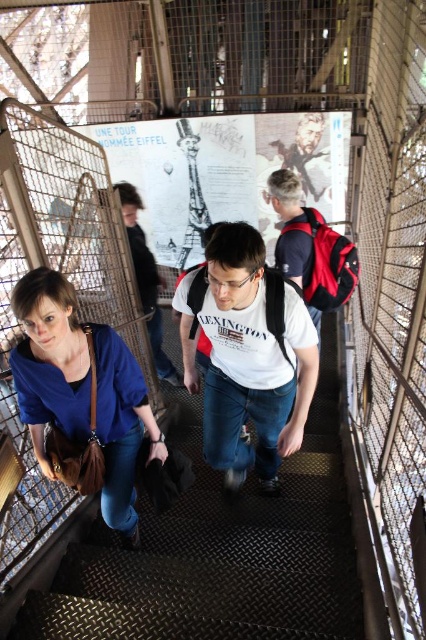
Between point (293, 131) and point (149, 280), which one is positioned in front?

Point (149, 280)

Between point (172, 248) and point (129, 228), which one is positioned behind?

Positioned behind is point (172, 248).

Identify the location of matte white poster at center. The image size is (426, 640). (224, 172).

Image resolution: width=426 pixels, height=640 pixels. Find the location of `white matte t-shirt at center`. white matte t-shirt at center is located at coordinates (247, 355).

In the scene shown: Who is lower down, white matte t-shirt at center or white cotton t-shirt at center?

white matte t-shirt at center is below.

Measure the distance between white matte t-shirt at center and camera.

white matte t-shirt at center is 1.71 meters away from camera.

Locate an element on the screen. The width and height of the screenshot is (426, 640). white matte t-shirt at center is located at coordinates (247, 355).

Between point (8, 595) and point (124, 198), which one is positioned behind?

Point (124, 198)

Between black metal stairs at center and white cotton t-shirt at center, which one is positioned lower?

Positioned lower is black metal stairs at center.

Who is more forward, (314, 637) or (152, 262)?

Point (314, 637) is in front.

What are the coordinates of `black metal stairs at center` in the screenshot? It's located at (218, 552).